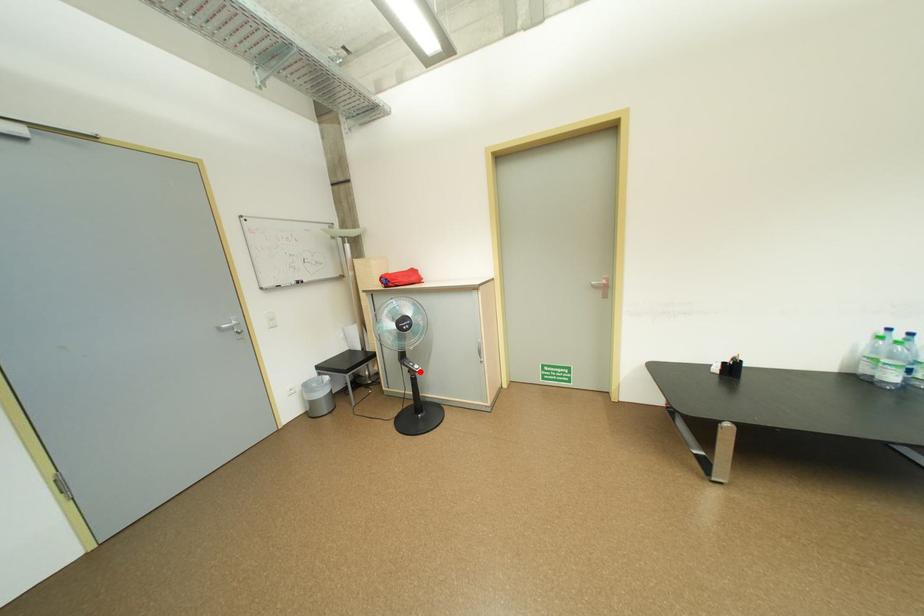
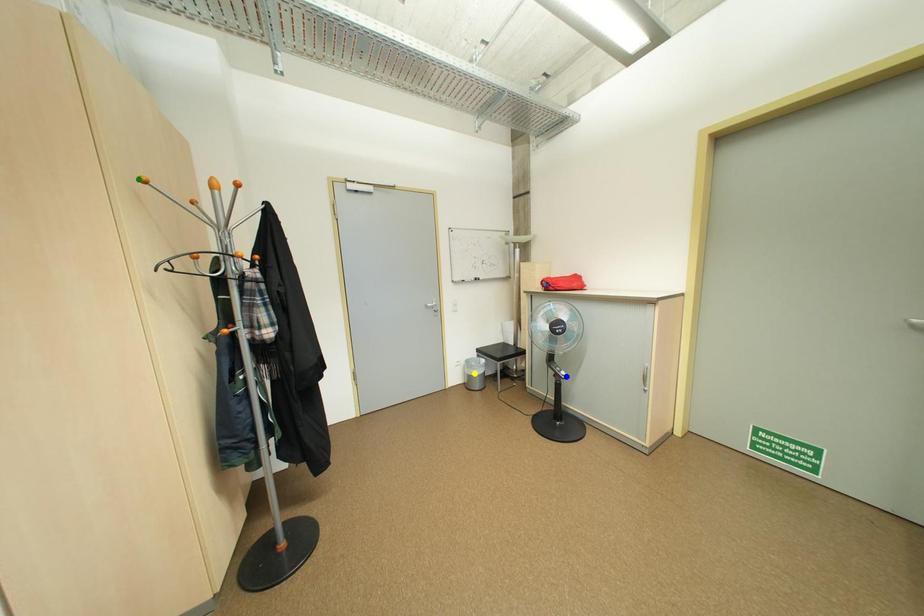
Question: I am providing you with two images of the same scene from different viewpoints. A red point is marked on the first image. You are given multiple points on the second image. Which spot in image 2 lines up with the point in image 1?

Choices:
 (A) yellow point
 (B) green point
 (C) blue point

Answer: (C)